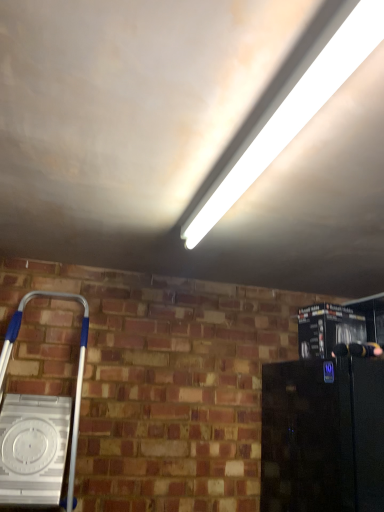
This screenshot has height=512, width=384. Describe the element at coordinates (328, 329) in the screenshot. I see `metallic black coffee maker at right, the first appliance when ordered from top to bottom` at that location.

The width and height of the screenshot is (384, 512). What do you see at coordinates (323, 436) in the screenshot? I see `black glossy refrigerator at lower right, which is the first appliance in bottom-to-top order` at bounding box center [323, 436].

Where is `white fluorescent tube at upper center`? The width and height of the screenshot is (384, 512). white fluorescent tube at upper center is located at coordinates (295, 111).

Identify the location of metallic black coffee maker at right, the 2th appliance from the bottom. (328, 329).

From a real-world perspective, is white fluorescent tube at upper center above or below silver metallic ladder at lower left?

white fluorescent tube at upper center is situated higher than silver metallic ladder at lower left in the real world.

Which is correct: white fluorescent tube at upper center is inside silver metallic ladder at lower left, or outside of it?

white fluorescent tube at upper center cannot be found inside silver metallic ladder at lower left.

From the image's perspective, which is below, white fluorescent tube at upper center or silver metallic ladder at lower left?

silver metallic ladder at lower left is shown below in the image.

Can you tell me how much white fluorescent tube at upper center and silver metallic ladder at lower left differ in facing direction?

The facing directions of white fluorescent tube at upper center and silver metallic ladder at lower left are 88.1 degrees apart.

In the scene shown: Is white fluorescent tube at upper center located outside black glossy refrigerator at lower right, placed as the 2th appliance when sorted from top to bottom?

Yes.

From a real-world perspective, does white fluorescent tube at upper center sit lower than black glossy refrigerator at lower right, which is the first appliance in bottom-to-top order?

No, from a real-world perspective, white fluorescent tube at upper center is not under black glossy refrigerator at lower right, which is the first appliance in bottom-to-top order.

Is white fluorescent tube at upper center placed right next to black glossy refrigerator at lower right, placed as the 2th appliance when sorted from top to bottom?

white fluorescent tube at upper center and black glossy refrigerator at lower right, placed as the 2th appliance when sorted from top to bottom, are not in contact.

From the image's perspective, is white fluorescent tube at upper center located above or below black glossy refrigerator at lower right, which is the first appliance in bottom-to-top order?

white fluorescent tube at upper center is situated higher than black glossy refrigerator at lower right, which is the first appliance in bottom-to-top order, in the image.

Is white fluorescent tube at upper center directly adjacent to metallic black coffee maker at right, the first appliance when ordered from top to bottom?

No.

Is white fluorescent tube at upper center positioned with its back to metallic black coffee maker at right, the 2th appliance from the bottom?

That's not correct — white fluorescent tube at upper center is not looking away from metallic black coffee maker at right, the 2th appliance from the bottom.

Which object is more forward, white fluorescent tube at upper center or metallic black coffee maker at right, the 2th appliance from the bottom?

white fluorescent tube at upper center is closer to the camera.

Is white fluorescent tube at upper center completely or partially outside of metallic black coffee maker at right, the first appliance when ordered from top to bottom?

white fluorescent tube at upper center lies outside metallic black coffee maker at right, the first appliance when ordered from top to bottom,'s area.

Can you confirm if silver metallic ladder at lower left is taller than white fluorescent tube at upper center?

Yes.

From the image's perspective, is silver metallic ladder at lower left positioned above or below white fluorescent tube at upper center?

Clearly, from the image's perspective, silver metallic ladder at lower left is below white fluorescent tube at upper center.

Are silver metallic ladder at lower left and white fluorescent tube at upper center far apart?

Yes, silver metallic ladder at lower left and white fluorescent tube at upper center are quite far apart.

Is metallic black coffee maker at right, the first appliance when ordered from top to bottom, shorter than white fluorescent tube at upper center?

Incorrect, the height of metallic black coffee maker at right, the first appliance when ordered from top to bottom, does not fall short of that of white fluorescent tube at upper center.

Looking at this image, is metallic black coffee maker at right, the 2th appliance from the bottom, positioned beyond the bounds of white fluorescent tube at upper center?

Yes, metallic black coffee maker at right, the 2th appliance from the bottom, is located beyond the bounds of white fluorescent tube at upper center.

Which object is thinner, metallic black coffee maker at right, the 2th appliance from the bottom, or white fluorescent tube at upper center?

white fluorescent tube at upper center.

How far apart are metallic black coffee maker at right, the 2th appliance from the bottom, and white fluorescent tube at upper center?

metallic black coffee maker at right, the 2th appliance from the bottom, is 82.28 centimeters away from white fluorescent tube at upper center.

Is black glossy refrigerator at lower right, which is the first appliance in bottom-to-top order, in front of or behind silver metallic ladder at lower left in the image?

Visually, black glossy refrigerator at lower right, which is the first appliance in bottom-to-top order, is located behind silver metallic ladder at lower left.

How distant is black glossy refrigerator at lower right, which is the first appliance in bottom-to-top order, from silver metallic ladder at lower left?

black glossy refrigerator at lower right, which is the first appliance in bottom-to-top order, is 37.66 inches from silver metallic ladder at lower left.

Is black glossy refrigerator at lower right, which is the first appliance in bottom-to-top order, directly adjacent to silver metallic ladder at lower left?

There is a gap between black glossy refrigerator at lower right, which is the first appliance in bottom-to-top order, and silver metallic ladder at lower left.

Is black glossy refrigerator at lower right, placed as the 2th appliance when sorted from top to bottom, completely or partially outside of silver metallic ladder at lower left?

Yes, black glossy refrigerator at lower right, placed as the 2th appliance when sorted from top to bottom, is outside of silver metallic ladder at lower left.

Considering the sizes of objects black glossy refrigerator at lower right, which is the first appliance in bottom-to-top order, and white fluorescent tube at upper center in the image provided, who is shorter, black glossy refrigerator at lower right, which is the first appliance in bottom-to-top order, or white fluorescent tube at upper center?

With less height is white fluorescent tube at upper center.

Which object is positioned more to the left, black glossy refrigerator at lower right, placed as the 2th appliance when sorted from top to bottom, or white fluorescent tube at upper center?

white fluorescent tube at upper center.

Is the surface of black glossy refrigerator at lower right, which is the first appliance in bottom-to-top order, in direct contact with white fluorescent tube at upper center?

No, black glossy refrigerator at lower right, which is the first appliance in bottom-to-top order, is not with white fluorescent tube at upper center.

Image resolution: width=384 pixels, height=512 pixels. I want to click on light that appears in front of the silver metallic ladder at lower left, so click(x=295, y=111).

Find the location of `light above the black glossy refrigerator at lower right, placed as the 2th appliance when sorted from top to bottom (from a real-world perspective)`. light above the black glossy refrigerator at lower right, placed as the 2th appliance when sorted from top to bottom (from a real-world perspective) is located at coordinates (295, 111).

From the image, which object appears to be nearer to silver metallic ladder at lower left, black glossy refrigerator at lower right, placed as the 2th appliance when sorted from top to bottom, or metallic black coffee maker at right, the 2th appliance from the bottom?

The object closer to silver metallic ladder at lower left is black glossy refrigerator at lower right, placed as the 2th appliance when sorted from top to bottom.

In the scene shown: Which object lies further to the anchor point black glossy refrigerator at lower right, placed as the 2th appliance when sorted from top to bottom, metallic black coffee maker at right, the 2th appliance from the bottom, or white fluorescent tube at upper center?

white fluorescent tube at upper center is positioned further to the anchor black glossy refrigerator at lower right, placed as the 2th appliance when sorted from top to bottom.

Estimate the real-world distances between objects in this image. Which object is further from silver metallic ladder at lower left, white fluorescent tube at upper center or black glossy refrigerator at lower right, placed as the 2th appliance when sorted from top to bottom?

Based on the image, white fluorescent tube at upper center appears to be further to silver metallic ladder at lower left.

Based on their spatial positions, is white fluorescent tube at upper center or black glossy refrigerator at lower right, placed as the 2th appliance when sorted from top to bottom, further from metallic black coffee maker at right, the 2th appliance from the bottom?

Based on the image, white fluorescent tube at upper center appears to be further to metallic black coffee maker at right, the 2th appliance from the bottom.

In the scene shown: Looking at the image, which one is located further to white fluorescent tube at upper center, metallic black coffee maker at right, the first appliance when ordered from top to bottom, or black glossy refrigerator at lower right, placed as the 2th appliance when sorted from top to bottom?

black glossy refrigerator at lower right, placed as the 2th appliance when sorted from top to bottom, lies further to white fluorescent tube at upper center than the other object.

Considering their positions, is white fluorescent tube at upper center positioned further to black glossy refrigerator at lower right, placed as the 2th appliance when sorted from top to bottom, than silver metallic ladder at lower left?

silver metallic ladder at lower left.

When comparing their distances from silver metallic ladder at lower left, does white fluorescent tube at upper center or metallic black coffee maker at right, the first appliance when ordered from top to bottom, seem closer?

metallic black coffee maker at right, the first appliance when ordered from top to bottom, lies closer to silver metallic ladder at lower left than the other object.

Considering their positions, is metallic black coffee maker at right, the 2th appliance from the bottom, positioned closer to silver metallic ladder at lower left than black glossy refrigerator at lower right, which is the first appliance in bottom-to-top order?

black glossy refrigerator at lower right, which is the first appliance in bottom-to-top order, is closer to silver metallic ladder at lower left.

Identify the location of appliance between silver metallic ladder at lower left and black glossy refrigerator at lower right, placed as the 2th appliance when sorted from top to bottom, in the horizontal direction. This screenshot has width=384, height=512. (328, 329).

The image size is (384, 512). Identify the location of appliance between white fluorescent tube at upper center and metallic black coffee maker at right, the 2th appliance from the bottom, in the front-back direction. (323, 436).

In order to click on light between silver metallic ladder at lower left and metallic black coffee maker at right, the first appliance when ordered from top to bottom, in the horizontal direction in this screenshot , I will do `click(295, 111)`.

At what (x,y) coordinates should I click in order to perform the action: click on light between silver metallic ladder at lower left and black glossy refrigerator at lower right, placed as the 2th appliance when sorted from top to bottom, from left to right. Please return your answer as a coordinate pair (x, y). Image resolution: width=384 pixels, height=512 pixels. Looking at the image, I should click on (295, 111).